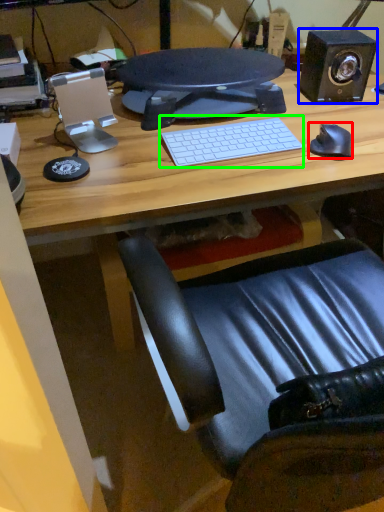
Question: Which object is the farthest from mouse (highlighted by a red box)? Choose among these: speaker (highlighted by a blue box) or computer keyboard (highlighted by a green box).

Choices:
 (A) speaker
 (B) computer keyboard

Answer: (A)